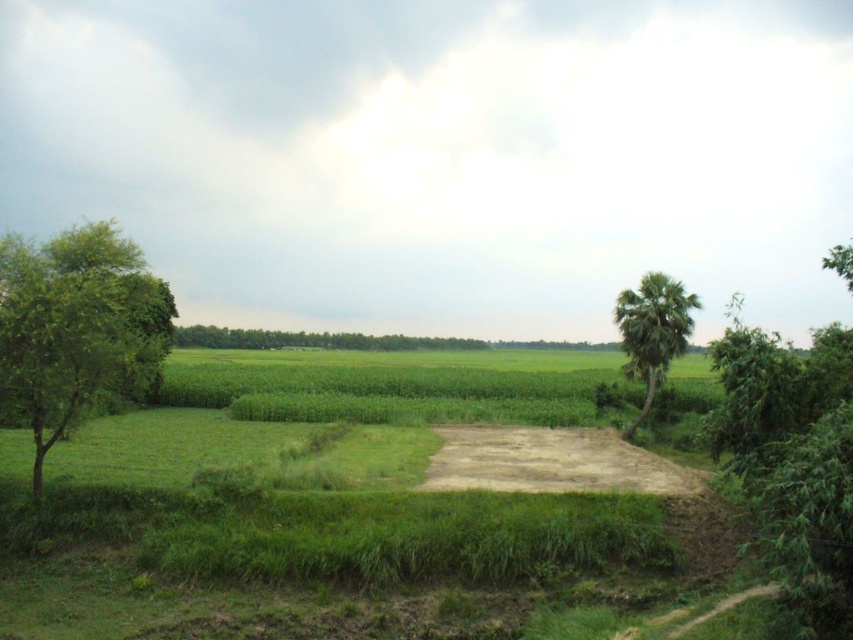
From the picture: Is green leafy tree at right above green leafy palm at right?

Indeed, green leafy tree at right is positioned over green leafy palm at right.

Can you confirm if green leafy tree at right is positioned to the right of green leafy palm at right?

Yes, green leafy tree at right is to the right of green leafy palm at right.

Which is in front, point (788, 460) or point (641, 342)?

Point (788, 460) is in front.

At what (x,y) coordinates should I click in order to perform the action: click on green leafy tree at right. Please return your answer as a coordinate pair (x, y). This screenshot has width=853, height=640. Looking at the image, I should click on (792, 460).

Is green leafy tree at left bigger than green leafy palm at right?

Yes, green leafy tree at left is bigger than green leafy palm at right.

From the picture: Can you confirm if green leafy tree at left is shorter than green leafy palm at right?

No, green leafy tree at left is not shorter than green leafy palm at right.

Is point (20, 298) farther from camera compared to point (666, 358)?

No, it is in front of (666, 358).

This screenshot has height=640, width=853. Find the location of `green leafy tree at left`. green leafy tree at left is located at coordinates (77, 326).

Does brown sandy dirt track at center come behind green leafy tree at center?

No, brown sandy dirt track at center is in front of green leafy tree at center.

Which is in front, point (607, 468) or point (527, 342)?

Point (607, 468)

Who is more forward, (x=601, y=445) or (x=544, y=348)?

Point (x=601, y=445) is more forward.

This screenshot has width=853, height=640. In order to click on brown sandy dirt track at center in this screenshot , I will do `click(550, 461)`.